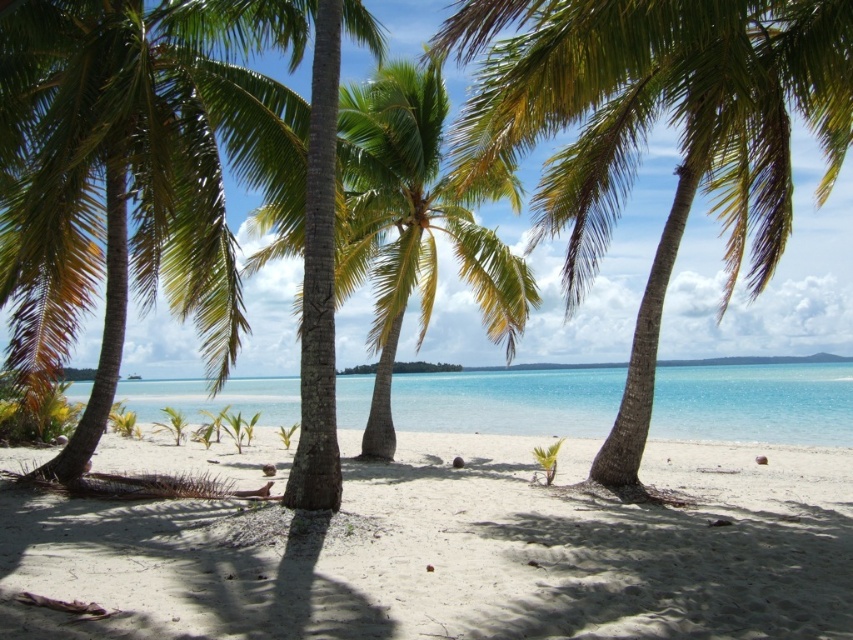
Question: Which point is closer to the camera taking this photo?

Choices:
 (A) (514, 604)
 (B) (166, 198)

Answer: (A)

Question: Which object appears closest to the camera in this image?

Choices:
 (A) green leafy palm tree at center
 (B) white sandy beach at center

Answer: (B)

Question: Is white sandy beach at center to the right of green leafy palm tree at center from the viewer's perspective?

Choices:
 (A) yes
 (B) no

Answer: (B)

Question: Can you confirm if white sandy beach at center is smaller than green leafy palm tree at left?

Choices:
 (A) yes
 (B) no

Answer: (B)

Question: Which of the following is the farthest from the observer?

Choices:
 (A) clear blue water at center
 (B) white sandy beach at center
 (C) green leafy palm tree at center
 (D) green leafy palm tree at left

Answer: (A)

Question: Is green leafy palm tree at left wider than clear blue water at center?

Choices:
 (A) yes
 (B) no

Answer: (B)